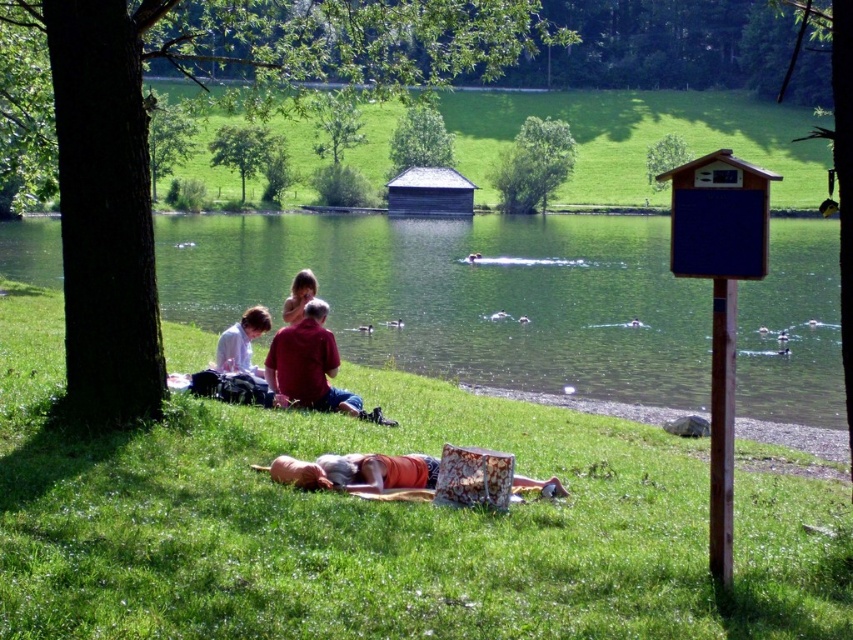
In the scene shown: You are standing at the point labeled as point (241, 333) and want to walk towards the lake. Is the point labeled as point (418, 326) in your path?

Point (418, 326) is behind point (241, 333), so it is not in your path towards the lake.

You are planning to take a photo of the green smooth water at center and the white paper at lower left. To ensure both are in the frame, should you adjust your camera upwards or downwards?

The green smooth water at center is above the white paper at lower left, so you should adjust your camera upwards to include both in the frame.